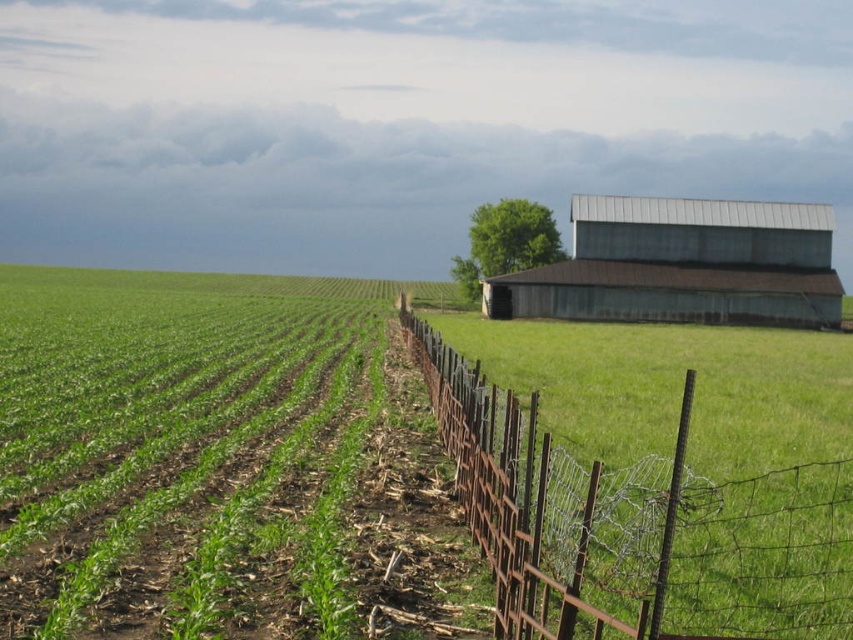
Question: Which of the following is the closest to the observer?

Choices:
 (A) rusty wire fence at right
 (B) green grass at center
 (C) green leafy corn at left
 (D) rusty corrugated metal barn at right

Answer: (A)

Question: Does rusty wire fence at right have a greater width compared to rusty corrugated metal barn at right?

Choices:
 (A) no
 (B) yes

Answer: (A)

Question: Does green leafy corn at left have a lesser width compared to rusty corrugated metal barn at right?

Choices:
 (A) yes
 (B) no

Answer: (B)

Question: Which point is closer to the camera taking this photo?

Choices:
 (A) (619, 563)
 (B) (56, 369)
 (C) (523, 273)

Answer: (A)

Question: Is green leafy corn at left bigger than rusty wire fence at right?

Choices:
 (A) yes
 (B) no

Answer: (A)

Question: Which of the following is the closest to the observer?

Choices:
 (A) (271, 314)
 (B) (798, 474)

Answer: (B)